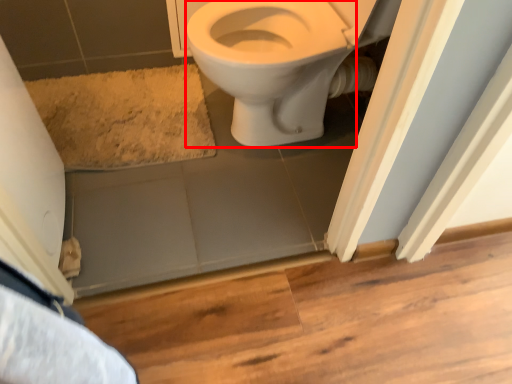
Question: Considering the relative positions of bidet (annotated by the red box) and bath mat in the image provided, where is bidet (annotated by the red box) located with respect to the staircase?

Choices:
 (A) right
 (B) left

Answer: (A)